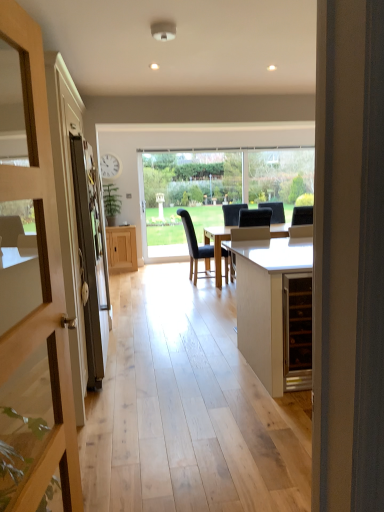
Question: Is wooden door at left aimed at matte black screen door at left?

Choices:
 (A) no
 (B) yes

Answer: (A)

Question: Is wooden door at left bigger than matte black screen door at left?

Choices:
 (A) no
 (B) yes

Answer: (A)

Question: Considering the relative sizes of wooden door at left and matte black screen door at left in the image provided, is wooden door at left taller than matte black screen door at left?

Choices:
 (A) no
 (B) yes

Answer: (B)

Question: Does wooden door at left have a lesser width compared to matte black screen door at left?

Choices:
 (A) yes
 (B) no

Answer: (A)

Question: Is the position of wooden door at left more distant than that of matte black screen door at left?

Choices:
 (A) yes
 (B) no

Answer: (B)

Question: Is wooden door at left far away from matte black screen door at left?

Choices:
 (A) no
 (B) yes

Answer: (B)

Question: Is wooden door at left facing towards black leather swivel chair at center?

Choices:
 (A) no
 (B) yes

Answer: (A)

Question: Is wooden door at left bigger than black leather swivel chair at center?

Choices:
 (A) yes
 (B) no

Answer: (B)

Question: Considering the relative sizes of wooden door at left and black leather swivel chair at center in the image provided, is wooden door at left smaller than black leather swivel chair at center?

Choices:
 (A) yes
 (B) no

Answer: (A)

Question: Is wooden door at left far away from black leather swivel chair at center?

Choices:
 (A) yes
 (B) no

Answer: (A)

Question: From the image's perspective, is wooden door at left located beneath black leather swivel chair at center?

Choices:
 (A) yes
 (B) no

Answer: (A)

Question: Considering the relative positions of wooden door at left and black leather swivel chair at center in the image provided, is wooden door at left to the left of black leather swivel chair at center from the viewer's perspective?

Choices:
 (A) yes
 (B) no

Answer: (A)

Question: Is black fabric chair at center not close to wooden door at left?

Choices:
 (A) no
 (B) yes

Answer: (B)